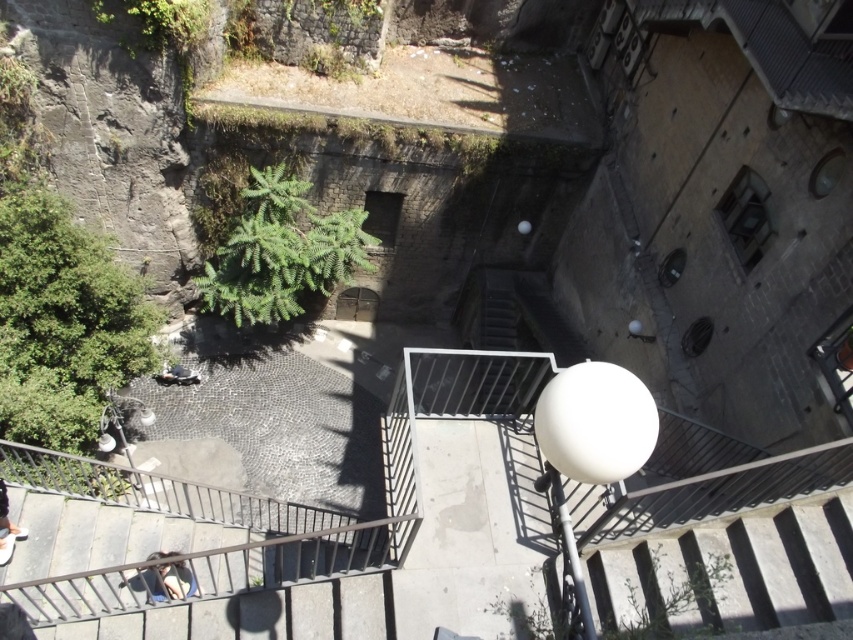
Question: Which of the following is the farthest from the observer?

Choices:
 (A) dark blue jeans at lower left
 (B) dark blue jeans at bottom left
 (C) dark gray fabric person at lower center
 (D) white glossy stairwell at lower right

Answer: (C)

Question: Estimate the real-world distances between objects in this image. Which object is closer to the dark blue jeans at lower left?

Choices:
 (A) white glossy stairwell at lower right
 (B) dark gray fabric person at lower center
 (C) dark blue jeans at bottom left

Answer: (C)

Question: Is dark blue jeans at bottom left to the right of dark gray fabric person at lower center from the viewer's perspective?

Choices:
 (A) no
 (B) yes

Answer: (B)

Question: In this image, where is dark blue jeans at bottom left located relative to dark gray fabric person at lower center?

Choices:
 (A) below
 (B) above

Answer: (A)

Question: Is white glossy stairwell at lower right below dark blue jeans at bottom left?

Choices:
 (A) no
 (B) yes

Answer: (A)

Question: Which of the following is the farthest from the observer?

Choices:
 (A) dark gray fabric person at lower center
 (B) dark blue jeans at lower left

Answer: (A)